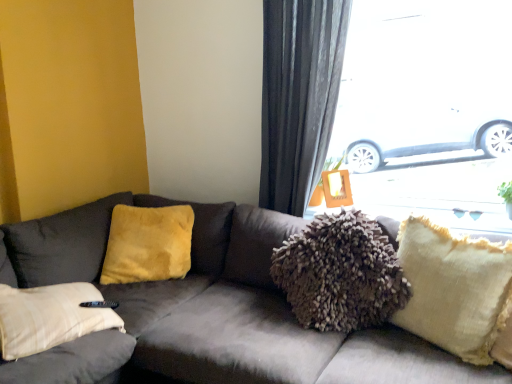
Question: From the image's perspective, is velvet gray couch at center located above or below beige textured pillow at right, which is the first pillow from right to left?

Choices:
 (A) above
 (B) below

Answer: (B)

Question: Is velvet gray couch at center to the left or to the right of beige textured pillow at right, which appears as the second pillow when viewed from the back, in the image?

Choices:
 (A) left
 (B) right

Answer: (A)

Question: Which of these objects is positioned farthest from the dark gray fabric curtain at upper right?

Choices:
 (A) beige textured pillow at right, which is the first pillow from right to left
 (B) velvet gray couch at center
 (C) transparent glass window at upper right
 (D) fuzzy fabric pillow at upper right
 (E) velvet yellow pillow at left, placed as the 1th pillow when sorted from left to right

Answer: (A)

Question: Which object is the farthest from the beige textured pillow at right, positioned as the 1th pillow in front-to-back order?

Choices:
 (A) dark gray fabric curtain at upper right
 (B) velvet yellow pillow at left, which is the 2th pillow in right-to-left order
 (C) fuzzy fabric pillow at upper right
 (D) velvet gray couch at center
 (E) transparent glass window at upper right

Answer: (B)